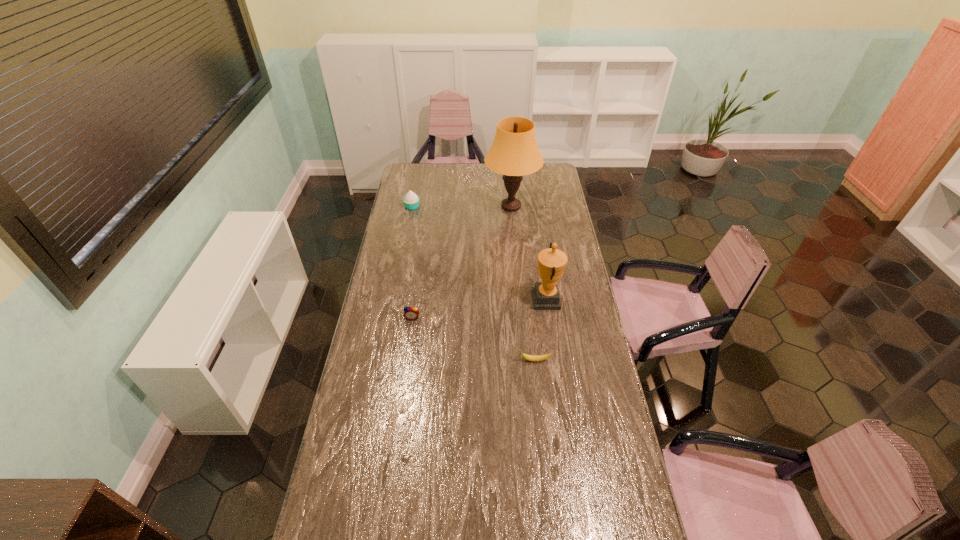
This screenshot has width=960, height=540. In order to click on empty space between the lampshade and the third nearest object in this screenshot , I will do `click(529, 253)`.

Locate an element on the screen. This screenshot has height=540, width=960. object that stands as the fourth closest to the fourth shortest object is located at coordinates (411, 201).

The width and height of the screenshot is (960, 540). What are the coordinates of `object that can be found as the second closest to the fourth object from right to left` in the screenshot? It's located at (551, 262).

Image resolution: width=960 pixels, height=540 pixels. I want to click on vacant area in the image that satisfies the following two spatial constraints: 1. at the front of the third farthest object with handles; 2. on the front-facing side of the second object from left to right, so click(x=549, y=318).